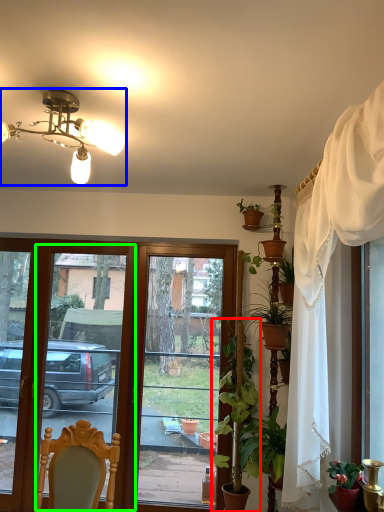
Question: Considering the real-world distances, which object is closest to houseplant (highlighted by a red box)? lamp (highlighted by a blue box) or screen door (highlighted by a green box).

Choices:
 (A) lamp
 (B) screen door

Answer: (A)